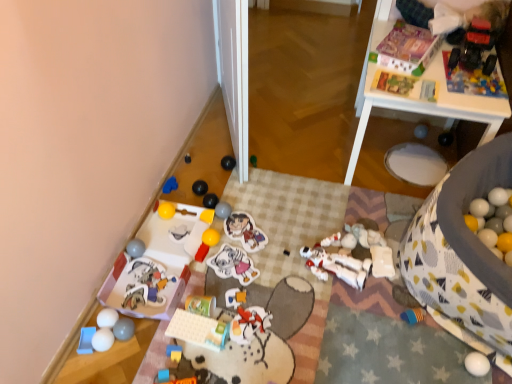
At what (x,y) coordinates should I click in order to perform the action: click on free spot to the left of white matte sticker at center, the 8th toy from the right. Please return your answer as a coordinate pair (x, y). This screenshot has width=512, height=384. Looking at the image, I should click on (195, 276).